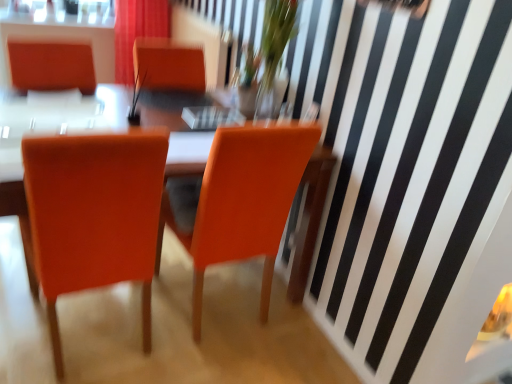
Question: Is matte red curtain at upper center located within translucent glass vase at upper center?

Choices:
 (A) yes
 (B) no

Answer: (B)

Question: Would you say translucent glass vase at upper center is a long distance from matte red curtain at upper center?

Choices:
 (A) yes
 (B) no

Answer: (A)

Question: Is translucent glass vase at upper center closer to camera compared to matte red curtain at upper center?

Choices:
 (A) no
 (B) yes

Answer: (B)

Question: Does translucent glass vase at upper center have a lesser width compared to matte red curtain at upper center?

Choices:
 (A) yes
 (B) no

Answer: (A)

Question: From a real-world perspective, is translucent glass vase at upper center located beneath matte red curtain at upper center?

Choices:
 (A) no
 (B) yes

Answer: (A)

Question: From the image's perspective, is matte orange chair at center, placed as the first chair when sorted from left to right, located above or below matte red curtain at upper center?

Choices:
 (A) below
 (B) above

Answer: (A)

Question: Is matte orange chair at center, the second chair positioned from the right, taller or shorter than matte red curtain at upper center?

Choices:
 (A) tall
 (B) short

Answer: (A)

Question: Does point (54, 233) appear closer or farther from the camera than point (117, 26)?

Choices:
 (A) farther
 (B) closer

Answer: (B)

Question: Is matte orange chair at center, the second chair positioned from the right, spatially inside matte red curtain at upper center, or outside of it?

Choices:
 (A) inside
 (B) outside

Answer: (B)

Question: Is translucent glass vase at upper center bigger or smaller than matte orange chair at center, placed as the first chair when sorted from left to right?

Choices:
 (A) big
 (B) small

Answer: (B)

Question: Considering their positions, is translucent glass vase at upper center located in front of or behind matte orange chair at center, the second chair positioned from the right?

Choices:
 (A) front
 (B) behind

Answer: (B)

Question: From their relative heights in the image, would you say translucent glass vase at upper center is taller or shorter than matte orange chair at center, the second chair positioned from the right?

Choices:
 (A) short
 (B) tall

Answer: (A)

Question: From a real-world perspective, is translucent glass vase at upper center physically located above or below matte orange chair at center, the second chair positioned from the right?

Choices:
 (A) below
 (B) above

Answer: (B)

Question: Is matte red curtain at upper center spatially inside matte orange chair at center, placed as the first chair when sorted from left to right, or outside of it?

Choices:
 (A) outside
 (B) inside

Answer: (A)

Question: Based on their sizes in the image, would you say matte red curtain at upper center is bigger or smaller than matte orange chair at center, placed as the first chair when sorted from left to right?

Choices:
 (A) small
 (B) big

Answer: (A)